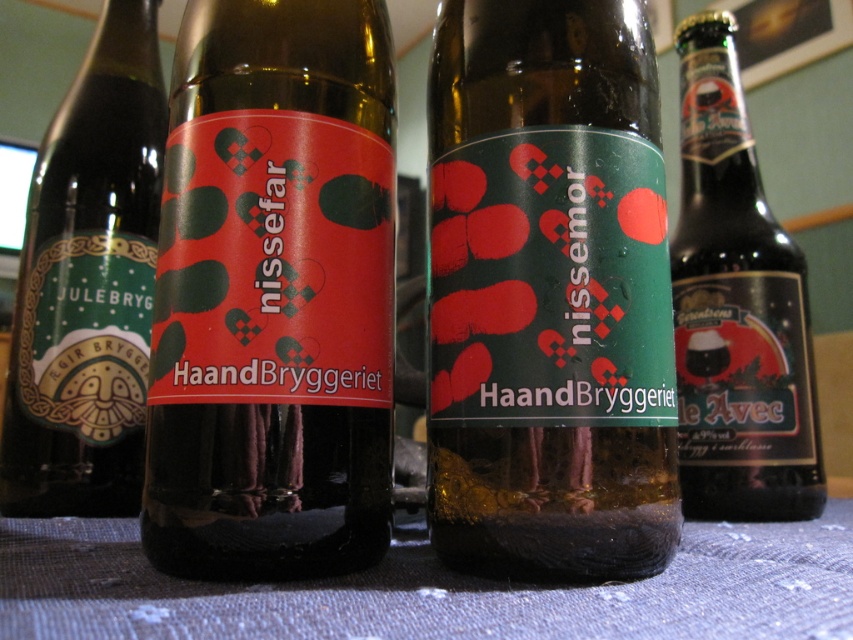
Question: Among these objects, which one is farthest from the camera?

Choices:
 (A) dark brown glass bottle at right
 (B) matte glass bottle at center
 (C) green matte bottle at center

Answer: (A)

Question: Is matte glass bottle at center bigger than dark brown glass bottle at right?

Choices:
 (A) no
 (B) yes

Answer: (A)

Question: Which object appears closest to the camera in this image?

Choices:
 (A) green matte bottle at left
 (B) dark brown glass bottle at right

Answer: (A)

Question: Which of these objects is positioned farthest from the matte glass bottle at center?

Choices:
 (A) green matte bottle at center
 (B) green matte bottle at left
 (C) dark brown glass bottle at right

Answer: (C)

Question: Does green matte bottle at center appear under green matte bottle at left?

Choices:
 (A) yes
 (B) no

Answer: (A)

Question: Observing the image, what is the correct spatial positioning of matte glass bottle at center in reference to dark brown glass bottle at right?

Choices:
 (A) above
 (B) below

Answer: (B)